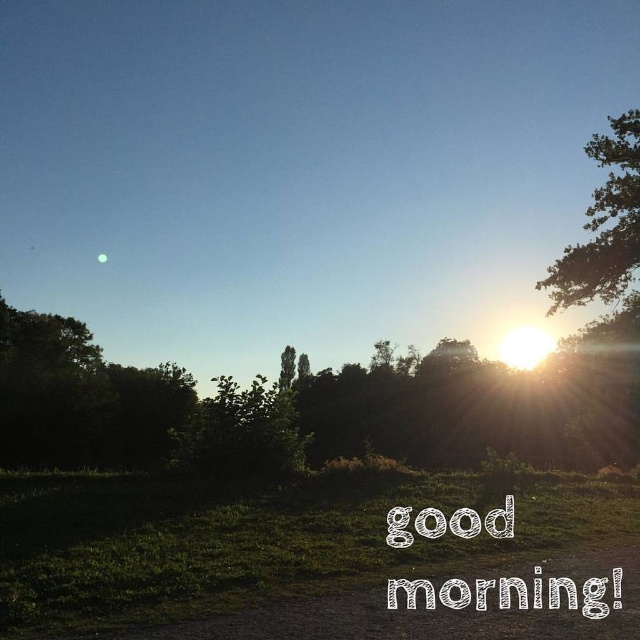
Question: Is green leafy tree at center bigger than greenish-gray sphere at upper left?

Choices:
 (A) yes
 (B) no

Answer: (A)

Question: Which point appears closest to the camera in this image?

Choices:
 (A) (291, 349)
 (B) (636, 262)

Answer: (B)

Question: Among these points, which one is nearest to the camera?

Choices:
 (A) (99, 257)
 (B) (618, 166)
 (C) (288, 349)

Answer: (B)

Question: Can you confirm if green leafy tree at upper right is thinner than green leafy tree at center?

Choices:
 (A) no
 (B) yes

Answer: (A)

Question: Can you confirm if green leafy tree at center is bigger than greenish-gray sphere at upper left?

Choices:
 (A) no
 (B) yes

Answer: (B)

Question: Which object appears closest to the camera in this image?

Choices:
 (A) greenish-gray sphere at upper left
 (B) green leafy tree at center

Answer: (B)